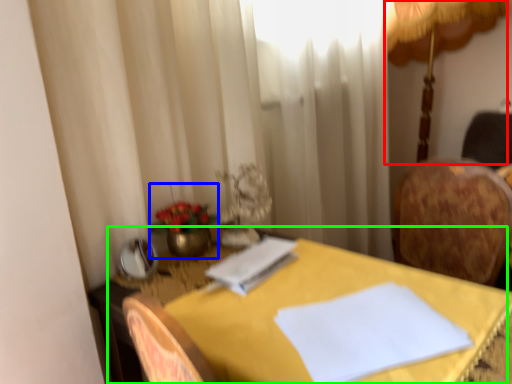
Question: Estimate the real-world distances between objects in this image. Which object is closer to table lamp (highlighted by a red box), floral arrangement (highlighted by a blue box) or table (highlighted by a green box)?

Choices:
 (A) floral arrangement
 (B) table

Answer: (B)